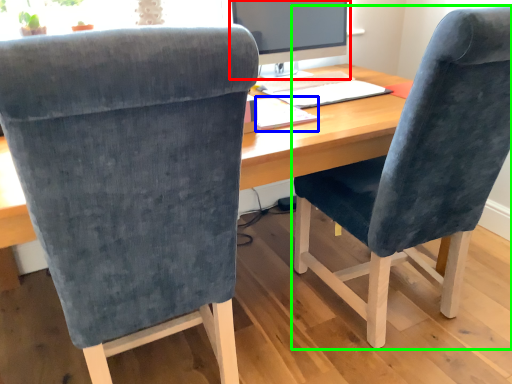
Question: Estimate the real-world distances between objects in this image. Which object is closer to computer monitor (highlighted by a red box), notepad (highlighted by a blue box) or chair (highlighted by a green box)?

Choices:
 (A) notepad
 (B) chair

Answer: (A)